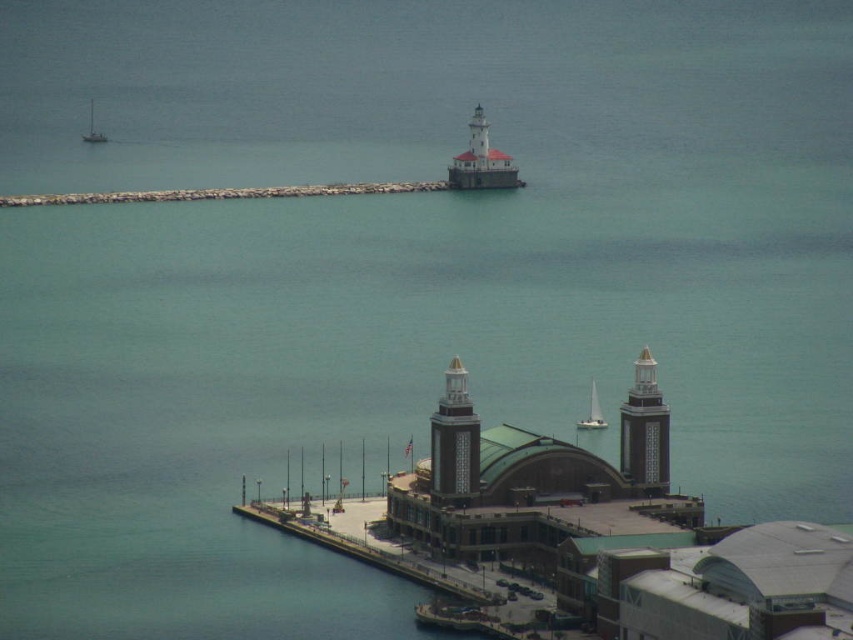
Question: Does smooth gray tower at center have a smaller size compared to white sailboat at upper left?

Choices:
 (A) yes
 (B) no

Answer: (B)

Question: Which point appears farthest from the camera in this image?

Choices:
 (A) (433, 465)
 (B) (648, 404)
 (C) (91, 113)
 (D) (592, 419)

Answer: (C)

Question: Can you confirm if white painted concrete lighthouse at upper center is smaller than white sailboat at center?

Choices:
 (A) yes
 (B) no

Answer: (B)

Question: From the image, what is the correct spatial relationship of white painted concrete lighthouse at upper center in relation to white sailboat at center?

Choices:
 (A) below
 (B) above

Answer: (B)

Question: Which point appears farthest from the camera in this image?

Choices:
 (A) coord(587,429)
 (B) coord(480,145)

Answer: (B)

Question: Which of the following is the farthest from the observer?

Choices:
 (A) (479, 152)
 (B) (592, 417)
 (C) (642, 433)
 (D) (457, 445)

Answer: (C)